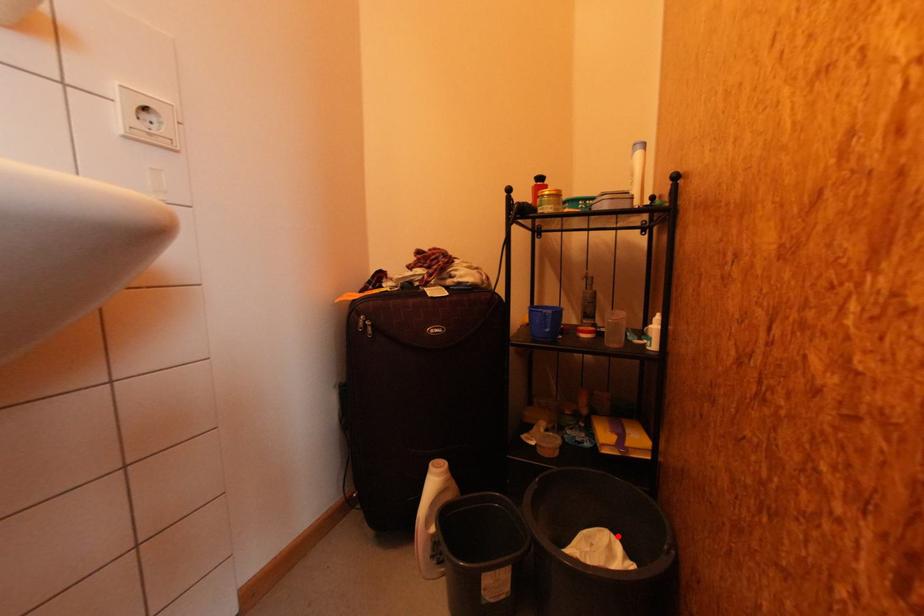
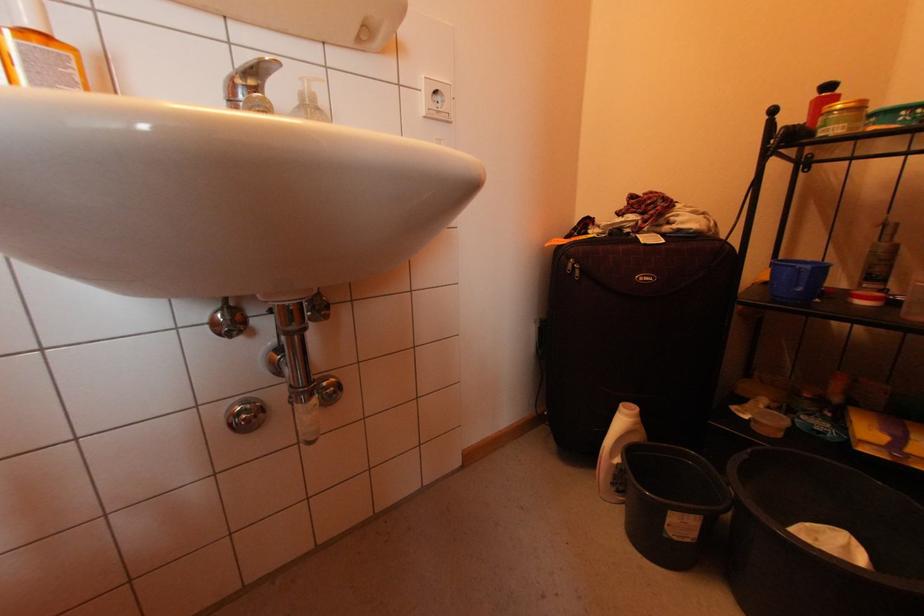
The point at the highlighted location is marked in the first image. Where is the corresponding point in the second image?

(860, 541)